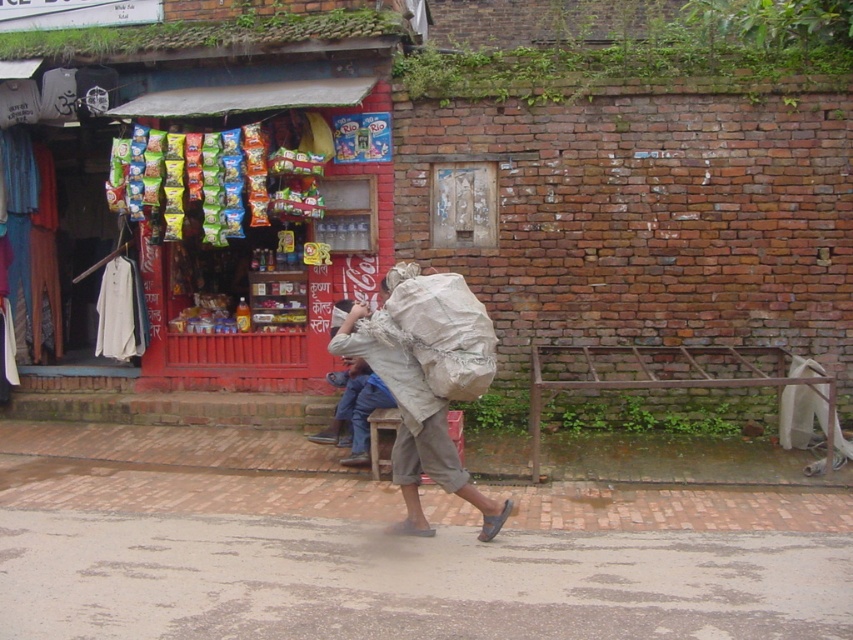
Question: Which object is closer to the camera taking this photo?

Choices:
 (A) red brick wall at upper center
 (B) white paper sack at center

Answer: (B)

Question: Is red brick wall at upper center closer to camera compared to white paper sack at center?

Choices:
 (A) yes
 (B) no

Answer: (B)

Question: Can you confirm if red brick wall at upper center is bigger than white paper sack at center?

Choices:
 (A) yes
 (B) no

Answer: (A)

Question: Does red brick wall at upper center appear over white paper sack at center?

Choices:
 (A) yes
 (B) no

Answer: (A)

Question: Which of the following is the closest to the observer?

Choices:
 (A) (62, 44)
 (B) (490, 499)

Answer: (B)